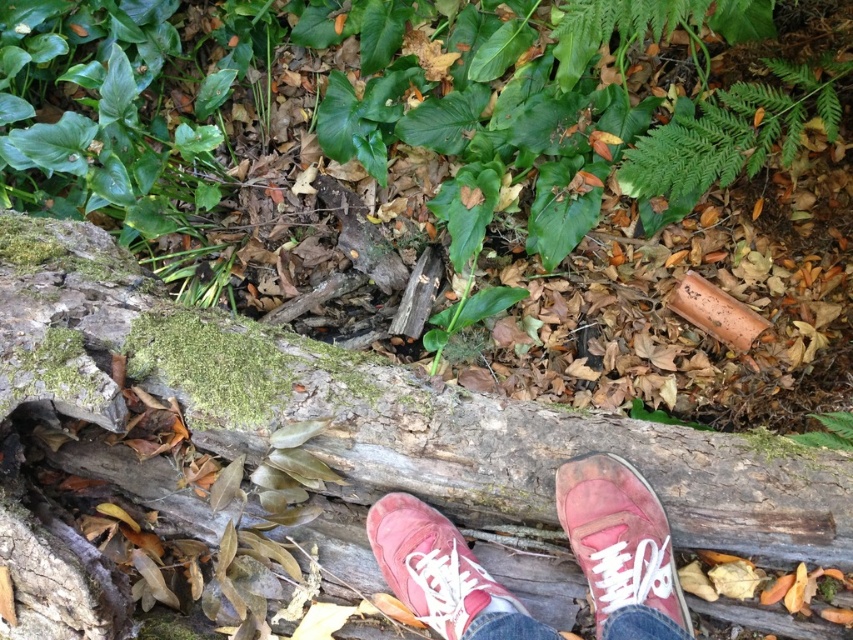
You are standing in a forest and see the rough bark log at center and the matte pink canvas shoe at center. Which object is positioned to the left from your perspective?

The rough bark log at center is to the left of the matte pink canvas shoe at center from your perspective.

You are standing in a forest and see a point at coordinates (381, 410). Based on the scene description, what is this point likely located on?

The point at coordinates (381, 410) is on a rough bark log at center.